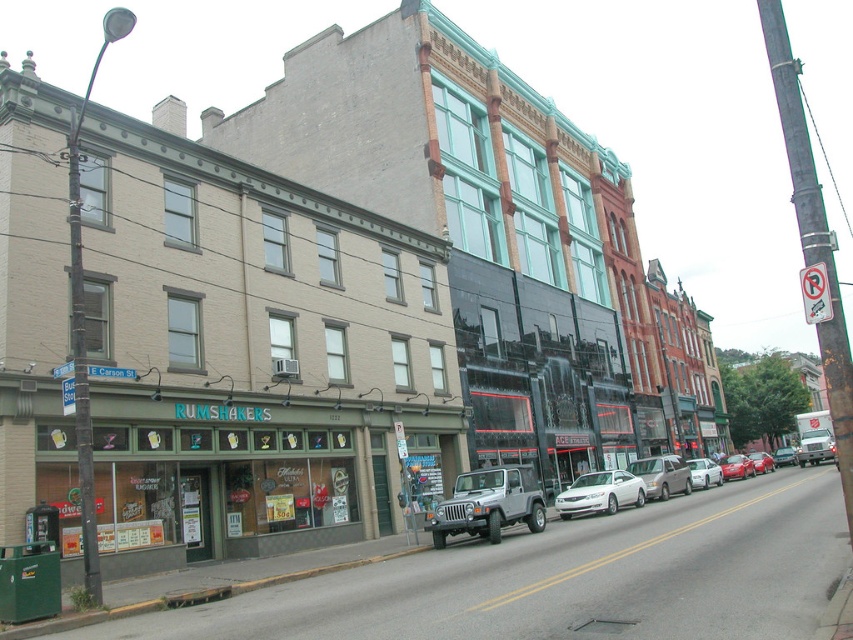
How much distance is there between silver metallic van at center and matte silver sedan at center?

The distance of silver metallic van at center from matte silver sedan at center is 22.02 meters.

Measure the distance between point [653,460] and camera.

A distance of 104.03 feet exists between point [653,460] and camera.

Identify the location of silver metallic van at center. The image size is (853, 640). (662, 476).

Is metallic red sedan at center-right to the left of metallic red sedan at center from the viewer's perspective?

Correct, you'll find metallic red sedan at center-right to the left of metallic red sedan at center.

Can you confirm if metallic red sedan at center-right is positioned below metallic red sedan at center?

No.

Does point (741, 465) come closer to viewer compared to point (755, 458)?

Yes, it is.

You are a GUI agent. You are given a task and a screenshot of the screen. Output one action in this format:
    pyautogui.click(x=<x>, y=<y>)
    Task: Click on the metallic red sedan at center-right
    This screenshot has height=640, width=853.
    Given the screenshot: What is the action you would take?
    pyautogui.click(x=735, y=467)

Does white glossy sedan at center lie behind metallic red sedan at center?

No, it is not.

Does white glossy sedan at center have a lesser height compared to metallic red sedan at center?

Indeed, white glossy sedan at center has a lesser height compared to metallic red sedan at center.

Is point (583, 499) behind point (749, 454)?

That is False.

Find the location of a particular element. This screenshot has height=640, width=853. white glossy sedan at center is located at coordinates (601, 493).